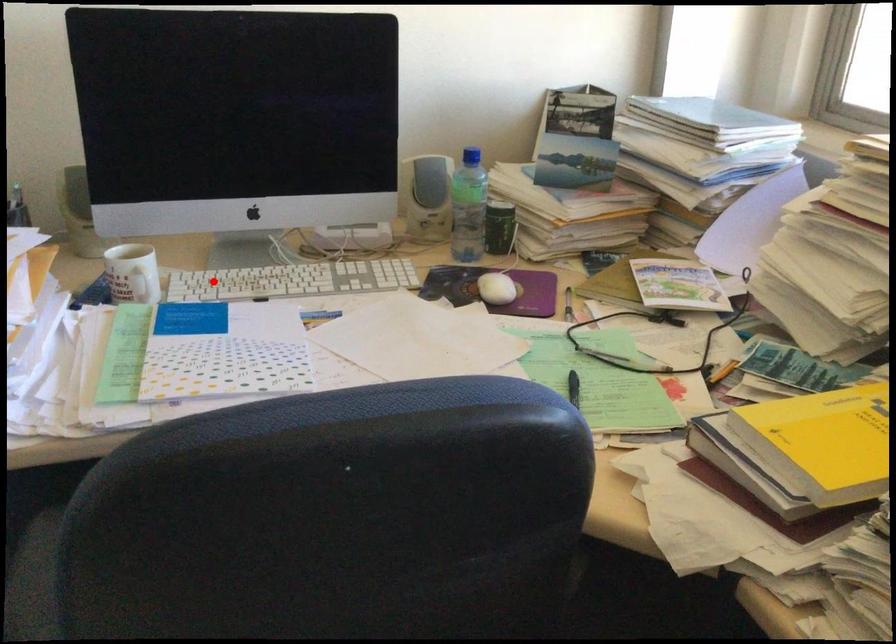
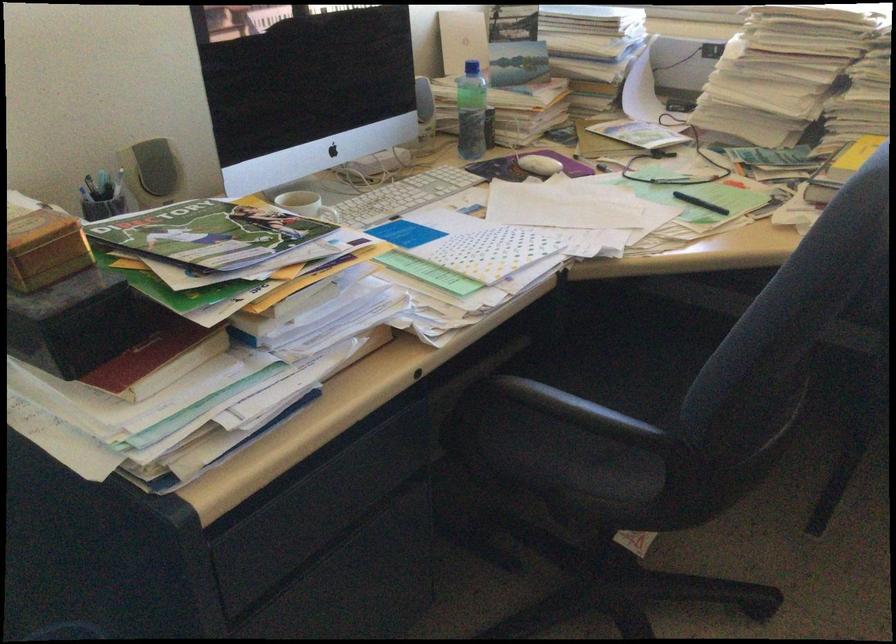
Where in the second image is the point corresponding to the highlighted location from the first image?

(334, 216)